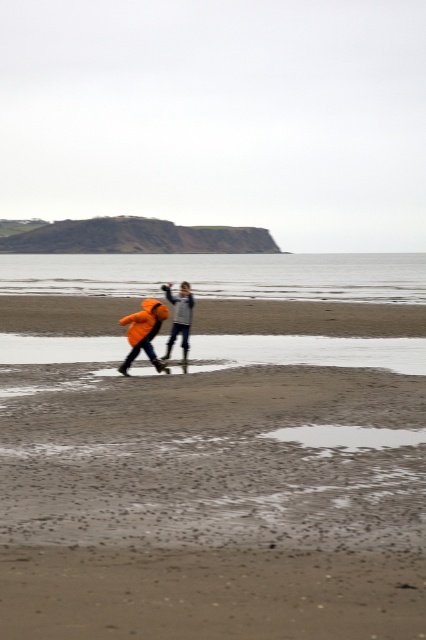
You are standing on the sandy beach at center and looking towards the orange waterproof jacket at center. Which object is closer to you?

The sandy beach at center is closer to you than the orange waterproof jacket at center.

In the scene shown: You are standing at the camera position and want to pick up the orange waterproof jacket at center. Is it within a 50 feet distance?

The orange waterproof jacket at center is 50.58 feet away from the camera, so it is slightly beyond the 50 feet distance and cannot be reached without moving closer.